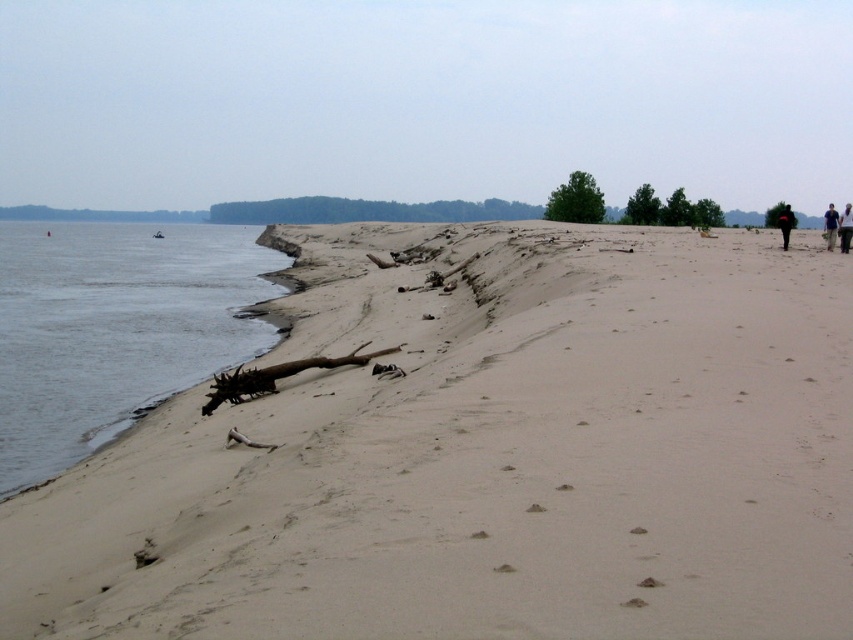
Question: Is gray water at lower left smaller than dark brown leather jacket at right?

Choices:
 (A) yes
 (B) no

Answer: (B)

Question: Which object is farther from the camera taking this photo?

Choices:
 (A) light beige sand at center
 (B) dark blue shirt at right
 (C) dark brown leather jacket at right
 (D) dark blue jeans at right

Answer: (B)

Question: Which point is farther to the camera?

Choices:
 (A) dark blue shirt at right
 (B) gray water at lower left
 (C) light beige sand at center

Answer: (A)

Question: Which point is closer to the camera?

Choices:
 (A) dark blue jeans at right
 (B) dark blue shirt at right
 (C) dark brown leather jacket at right
 (D) gray water at lower left

Answer: (D)

Question: Is gray water at lower left below dark blue shirt at right?

Choices:
 (A) no
 (B) yes

Answer: (B)

Question: Can you confirm if gray water at lower left is positioned to the left of dark brown leather jacket at right?

Choices:
 (A) yes
 (B) no

Answer: (A)